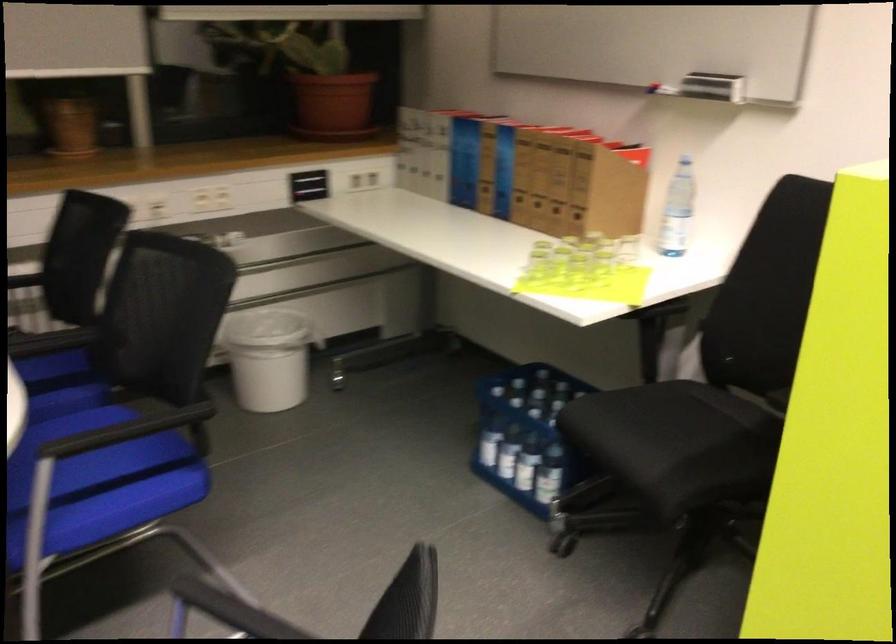
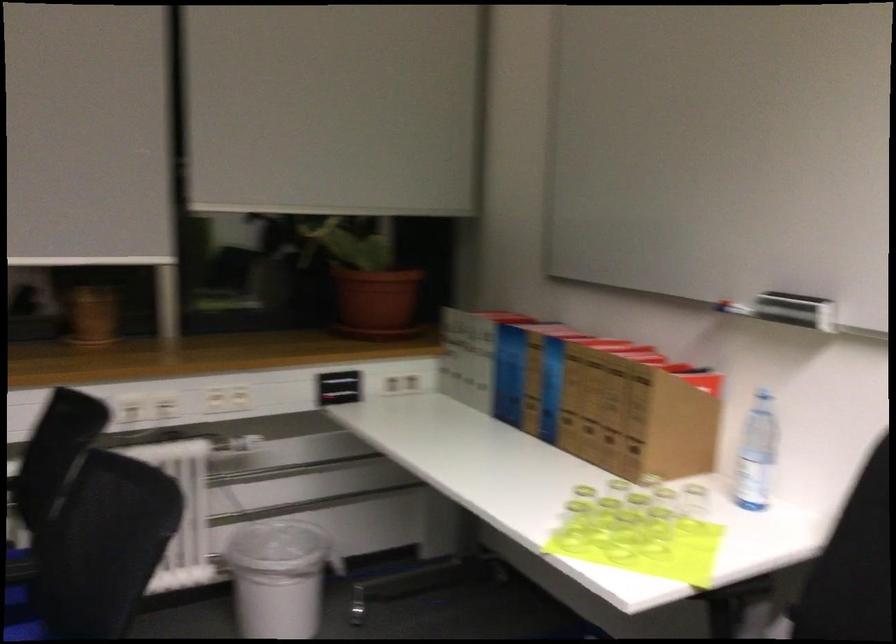
The point at (464, 165) is marked in the first image. Where is the corresponding point in the second image?

(509, 374)